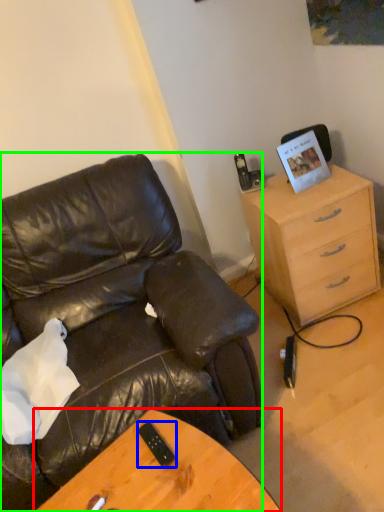
Question: Based on their relative distances, which object is farther from desk (highlighted by a red box)? Choose from mobile phone (highlighted by a blue box) and chair (highlighted by a green box).

Choices:
 (A) mobile phone
 (B) chair

Answer: (B)